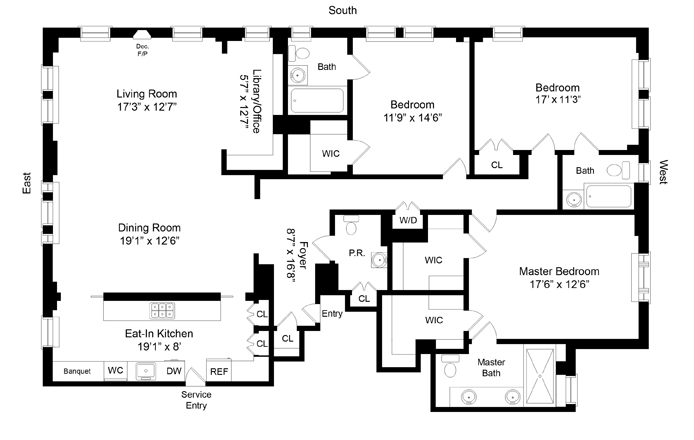
Where is `washer dryer`? washer dryer is located at coordinates (407, 219).